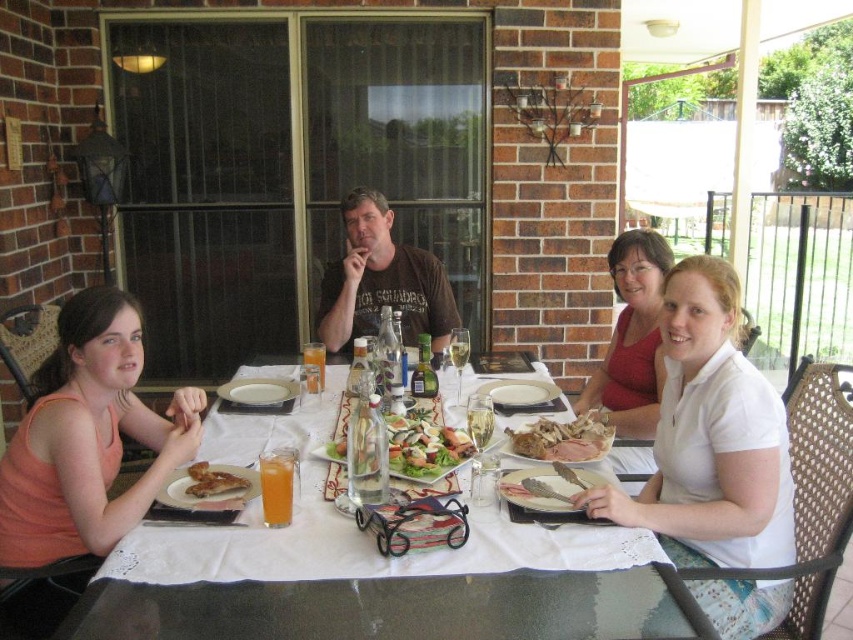
Question: Which object is farther from the camera taking this photo?

Choices:
 (A) white cotton shirt at center
 (B) fresh green salad at center
 (C) orange fabric shirt at left

Answer: (B)

Question: Does matte white shirt at center lie behind golden crispy chicken at center?

Choices:
 (A) yes
 (B) no

Answer: (A)

Question: Which point appears closest to the camera in this image?

Choices:
 (A) pos(637,604)
 (B) pos(189,468)
 (C) pos(746,460)
 (D) pos(641,346)

Answer: (A)

Question: Estimate the real-world distances between objects in this image. Which object is farther from the orange fabric shirt at left?

Choices:
 (A) matte white shirt at center
 (B) golden crispy chicken at center
 (C) golden brown roasted meat at center

Answer: (A)

Question: Considering the relative positions of orange fabric shirt at left and fresh green salad at center in the image provided, where is orange fabric shirt at left located with respect to fresh green salad at center?

Choices:
 (A) above
 (B) below

Answer: (A)

Question: Is white cotton shirt at center above orange fabric shirt at left?

Choices:
 (A) yes
 (B) no

Answer: (B)